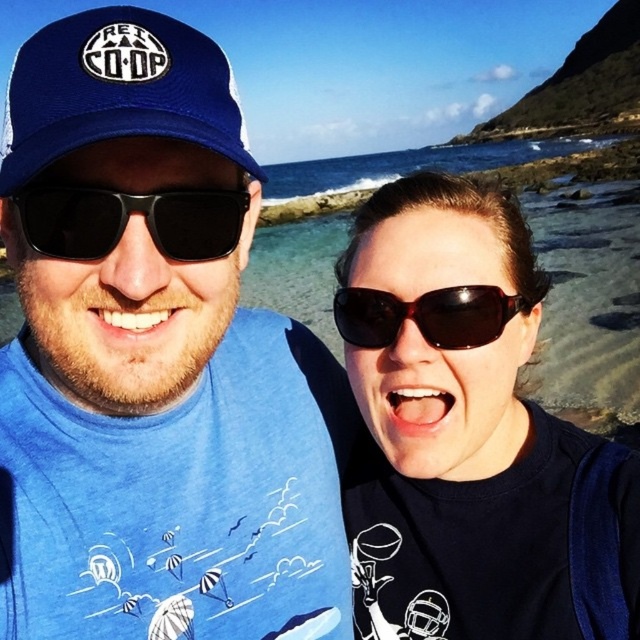
You are a photographer trying to capture a clear shot of the brown matte sunglasses at center. However, the blue fabric baseball cap at upper left is blocking your view. Can you adjust your position to move the cap out of the frame while keeping the sunglasses in view?

The blue fabric baseball cap at upper left is in front of the brown matte sunglasses at center, so moving the cap out of the frame would require adjusting the position so that the sunglasses remain visible while the cap is moved away or shifted sideways.

You are a photographer trying to capture a clear shot of the blue fabric shirt at center and the blue fabric baseball cap at upper left. Since the shirt is wider, will you need to adjust your camera angle to ensure both are fully visible in the frame?

The blue fabric shirt at center is wider than the blue fabric baseball cap at upper left, so you may need to adjust your camera angle to ensure the entire width of the shirt is captured while keeping the cap in view.

You are a photographer trying to capture a clear shot of the blue fabric baseball cap at upper left and the matte black sunglasses at center. Since the sunglasses are below the cap, where should you focus your camera to ensure both are in frame?

To ensure both the blue fabric baseball cap at upper left and the matte black sunglasses at center are in frame, focus your camera on the area between them since the matte black sunglasses at center is located below the blue fabric baseball cap at upper left.